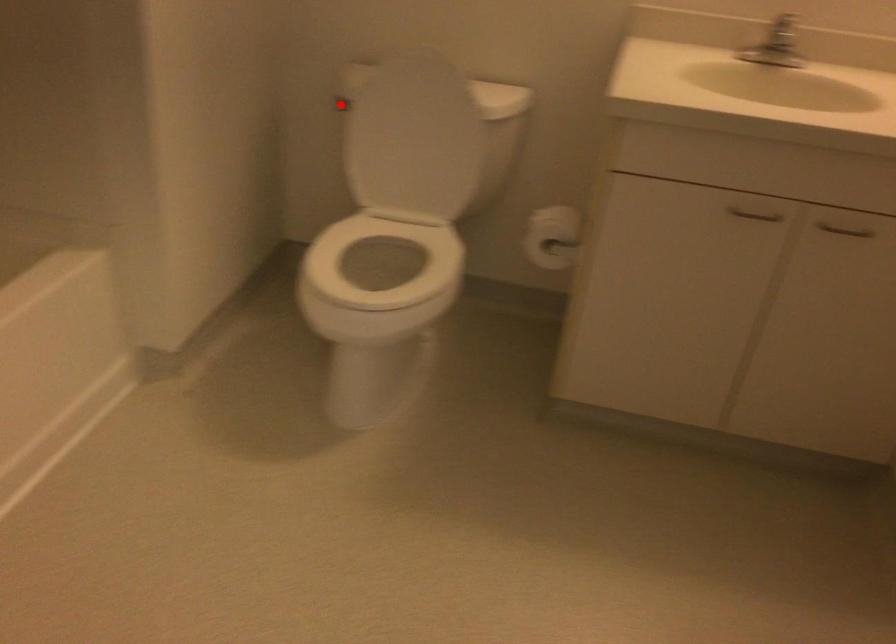
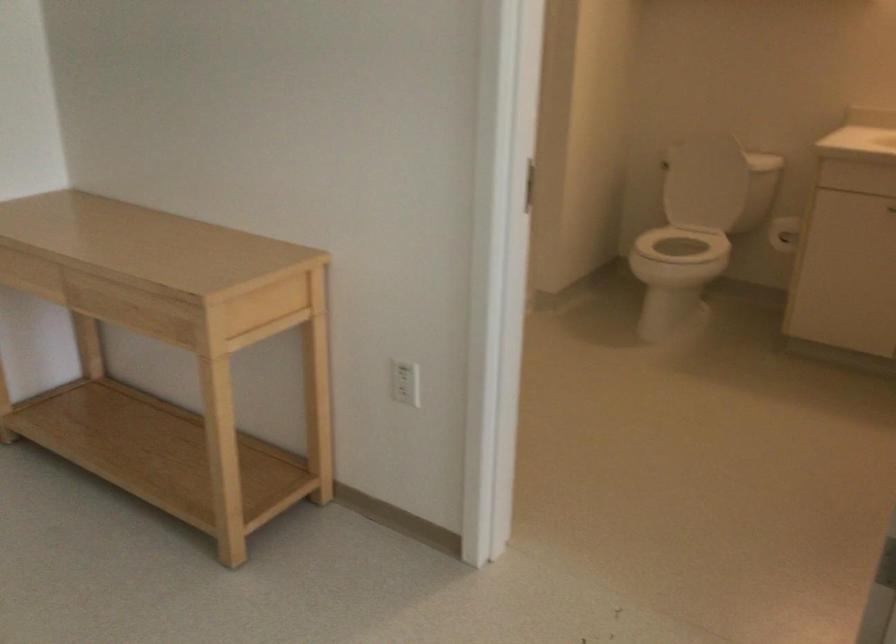
Question: I am providing you with two images of the same scene from different viewpoints. A red point is marked on the first image. At the location where the point appears in image 1, is it still visible in image 2?

Choices:
 (A) Yes
 (B) No

Answer: (B)